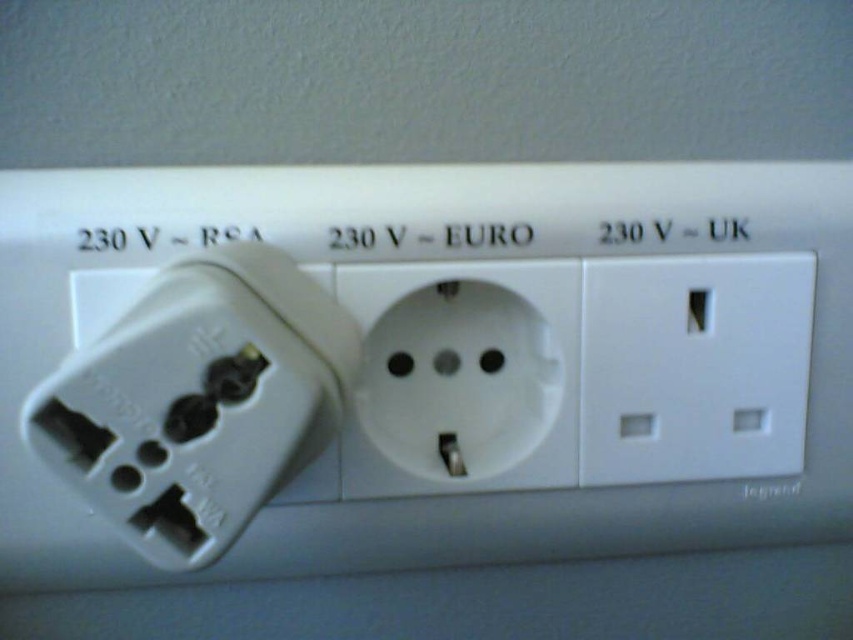
You are standing in front of the electrical outlet panel. There are two points marked on the panel at coordinates point (440, 397) and point (733, 442). Which point is closer to you?

Point (440, 397) is further to the camera than point (733, 442), so the point closer to you is point (733, 442).

You are an electrician looking at the electrical outlet panel. Where exactly is the white plastic plug at center located in terms of coordinates?

The white plastic plug at center is located at coordinates point (198, 401).